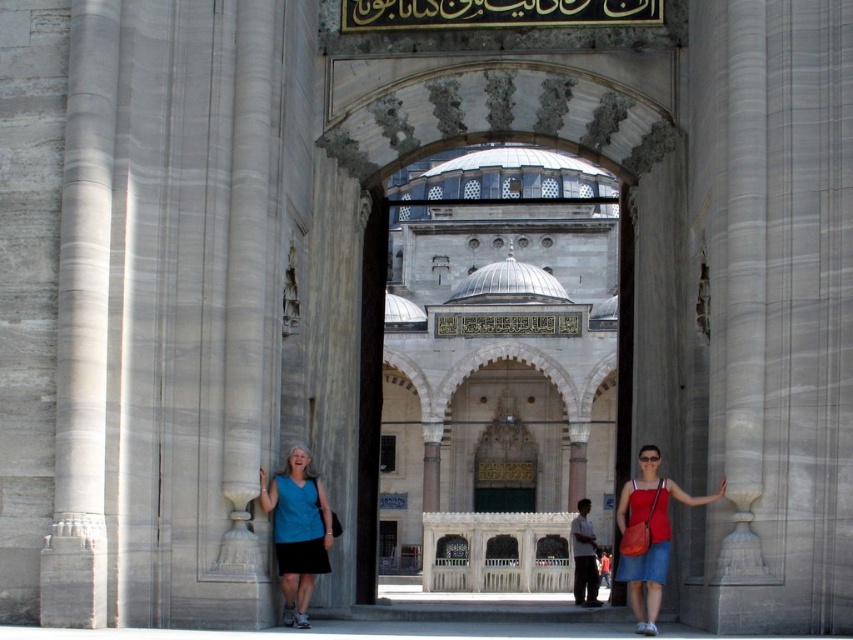
You are standing at the entrance of the mosque and want to place a small decoration on the ground near both the white marble arch at center and the red fabric bag at right. Which object should you place it closer to if you want it to be closer to the taller one?

You should place the decoration closer to the white marble arch at center because it is much taller than the red fabric bag at right.